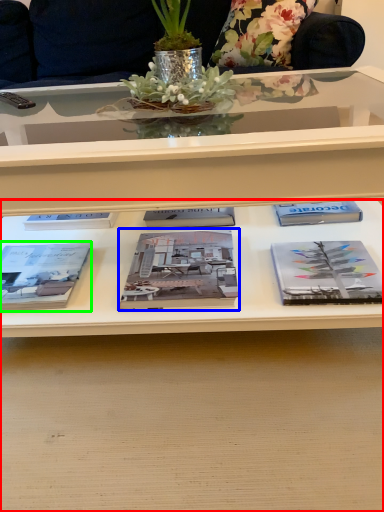
Question: Which object is positioned closest to desk (highlighted by a red box)? Select from book (highlighted by a blue box) and book (highlighted by a green box).

Choices:
 (A) book
 (B) book

Answer: (A)